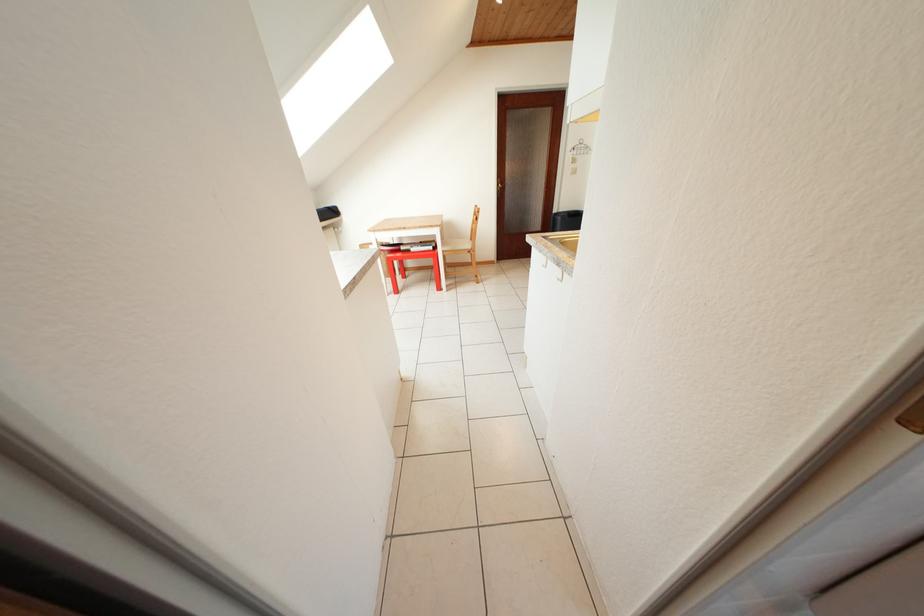
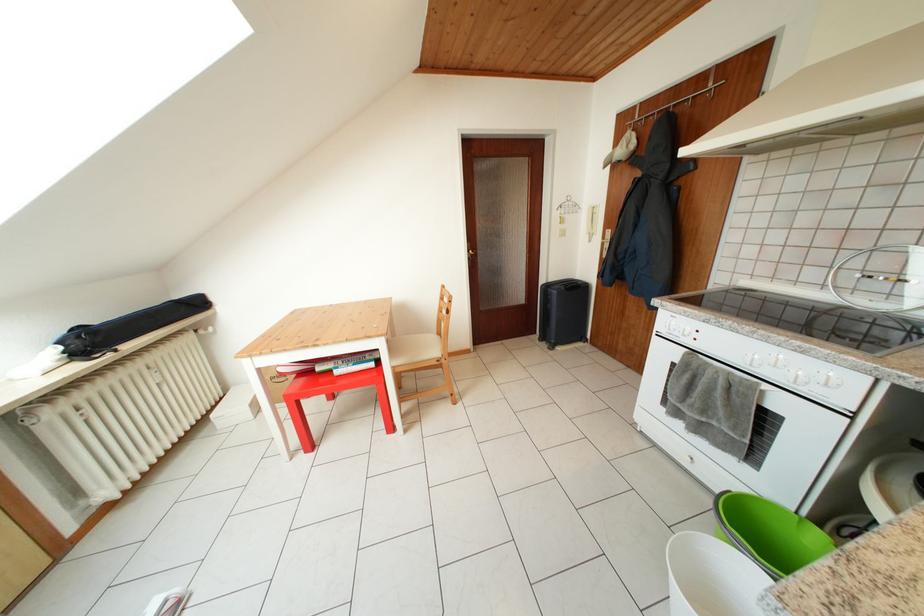
Locate, in the second image, the point that corresponds to (417,256) in the first image.

(338, 377)